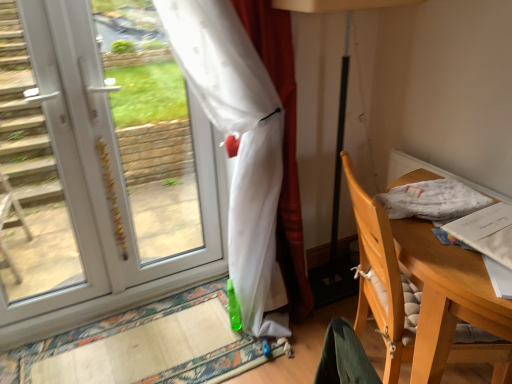
Question: Is white plastic door at left at the right side of translucent white curtain at left?

Choices:
 (A) no
 (B) yes

Answer: (A)

Question: From a real-world perspective, is white plastic door at left on top of translucent white curtain at left?

Choices:
 (A) yes
 (B) no

Answer: (A)

Question: Is translucent white curtain at left inside white plastic door at left?

Choices:
 (A) yes
 (B) no

Answer: (B)

Question: Is white plastic door at left turned away from translucent white curtain at left?

Choices:
 (A) no
 (B) yes

Answer: (A)

Question: Does white plastic door at left have a lesser width compared to translucent white curtain at left?

Choices:
 (A) no
 (B) yes

Answer: (B)

Question: Considering the relative positions of carpeted mat at lower left and black plastic table lamp at center in the image provided, is carpeted mat at lower left to the left or to the right of black plastic table lamp at center?

Choices:
 (A) left
 (B) right

Answer: (A)

Question: Is carpeted mat at lower left wider or thinner than black plastic table lamp at center?

Choices:
 (A) thin
 (B) wide

Answer: (B)

Question: From a real-world perspective, is carpeted mat at lower left above or below black plastic table lamp at center?

Choices:
 (A) above
 (B) below

Answer: (B)

Question: Considering the positions of point (174, 374) and point (385, 3), is point (174, 374) closer or farther from the camera than point (385, 3)?

Choices:
 (A) closer
 (B) farther

Answer: (B)

Question: In terms of width, does black plastic table lamp at center look wider or thinner when compared to translucent white curtain at left?

Choices:
 (A) thin
 (B) wide

Answer: (A)

Question: Is black plastic table lamp at center in front of or behind translucent white curtain at left in the image?

Choices:
 (A) behind
 (B) front

Answer: (A)

Question: In terms of height, does black plastic table lamp at center look taller or shorter compared to translucent white curtain at left?

Choices:
 (A) short
 (B) tall

Answer: (A)

Question: Is point (338, 130) closer or farther from the camera than point (226, 64)?

Choices:
 (A) farther
 (B) closer

Answer: (A)

Question: In terms of width, does white fabric at right look wider or thinner when compared to white plastic door at left?

Choices:
 (A) wide
 (B) thin

Answer: (A)

Question: Is white fabric at right bigger or smaller than white plastic door at left?

Choices:
 (A) big
 (B) small

Answer: (B)